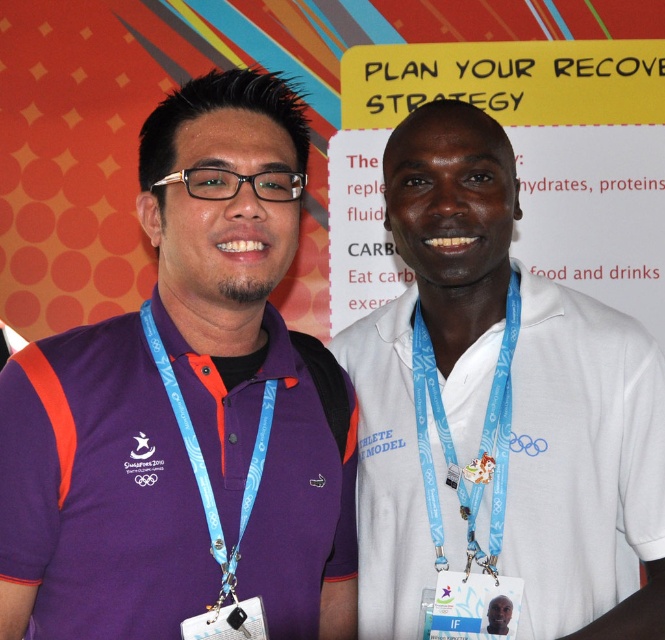
Question: Can you confirm if blue fabric lanyard at left is smaller than white fabric neck at center?

Choices:
 (A) no
 (B) yes

Answer: (A)

Question: Which object appears farthest from the camera in this image?

Choices:
 (A) light blue fabric lanyard at center
 (B) purple fabric shirt at left
 (C) blue fabric lanyard at left

Answer: (A)

Question: Which point appears closest to the camera in this image?

Choices:
 (A) (239, 285)
 (B) (15, 628)
 (C) (229, 564)

Answer: (B)

Question: In this image, where is blue fabric lanyard at left located relative to white fabric neck at center?

Choices:
 (A) right
 (B) left

Answer: (B)

Question: Which object appears farthest from the camera in this image?

Choices:
 (A) light blue fabric lanyard at center
 (B) purple fabric shirt at left
 (C) white fabric neck at center

Answer: (C)

Question: Can you confirm if purple fabric shirt at left is positioned to the right of light blue fabric lanyard at center?

Choices:
 (A) yes
 (B) no

Answer: (B)